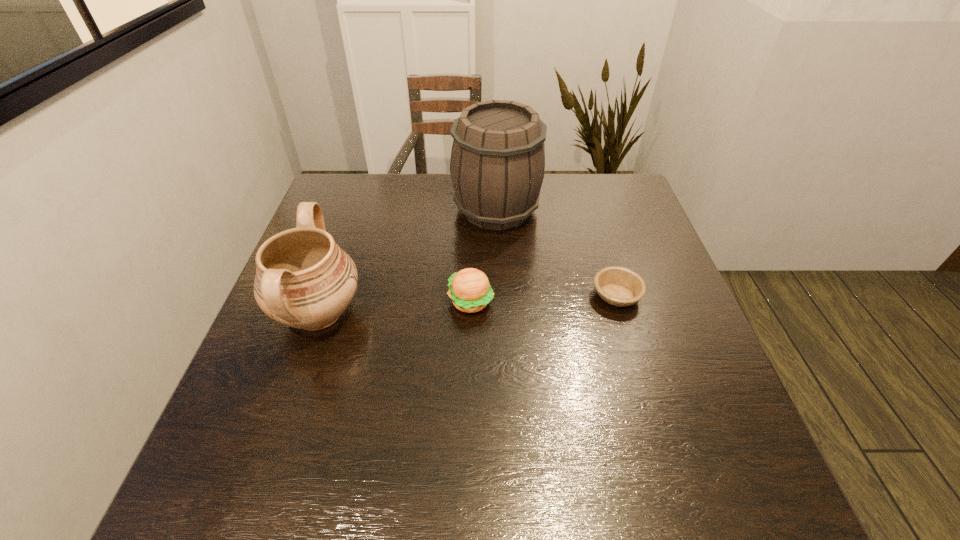
At what (x,y) coordinates should I click in order to perform the action: click on wine bucket. Please return your answer as a coordinate pair (x, y). This screenshot has width=960, height=540. Looking at the image, I should click on (497, 165).

The height and width of the screenshot is (540, 960). What are the coordinates of `the tallest object` in the screenshot? It's located at [497, 165].

I want to click on the second tallest object, so click(x=304, y=280).

The image size is (960, 540). Find the location of `urn`. urn is located at coordinates (304, 280).

Where is `hamburger`? The width and height of the screenshot is (960, 540). hamburger is located at coordinates (470, 290).

At what (x,y) coordinates should I click in order to perform the action: click on the rightmost object. Please return your answer as a coordinate pair (x, y). This screenshot has height=540, width=960. Looking at the image, I should click on (618, 286).

In order to click on the shortest object in this screenshot , I will do `click(618, 286)`.

This screenshot has height=540, width=960. In order to click on vacant region located 0.060m on the front of the tallest object in this screenshot , I will do `click(498, 252)`.

You are a GUI agent. You are given a task and a screenshot of the screen. Output one action in this format:
    pyautogui.click(x=<x>, y=<y>)
    Task: Click on the vacant space located 0.140m on the front-facing side of the second tallest object
    Image resolution: width=960 pixels, height=540 pixels.
    Given the screenshot: What is the action you would take?
    pyautogui.click(x=426, y=313)

In order to click on free point located 0.330m on the left of the second shortest object in this screenshot , I will do `click(307, 301)`.